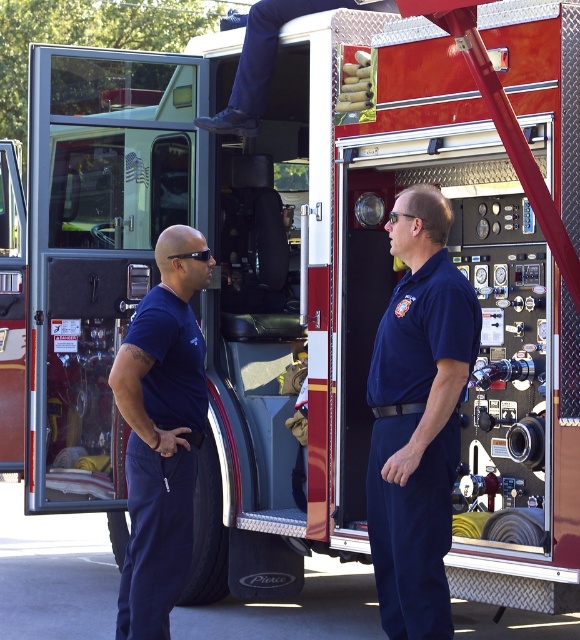
You are a firefighter who needs to locate your navy blue uniform. You are currently standing at the point marked as point (x=418, y=419). Can you tell me where your navy blue uniform is relative to your current position?

The navy blue uniform at center is located exactly at point (x=418, y=419), so it is right where you are standing.

You are a photographer trying to capture a group photo of the firefighters. Since you want to ensure everyone is visible, you need to know which firefighter is wider. Which firefighter has a wider uniform? The navy blue uniform at center or the dark blue uniform at center?

The navy blue uniform at center is wider than the dark blue uniform at center according to the description provided.